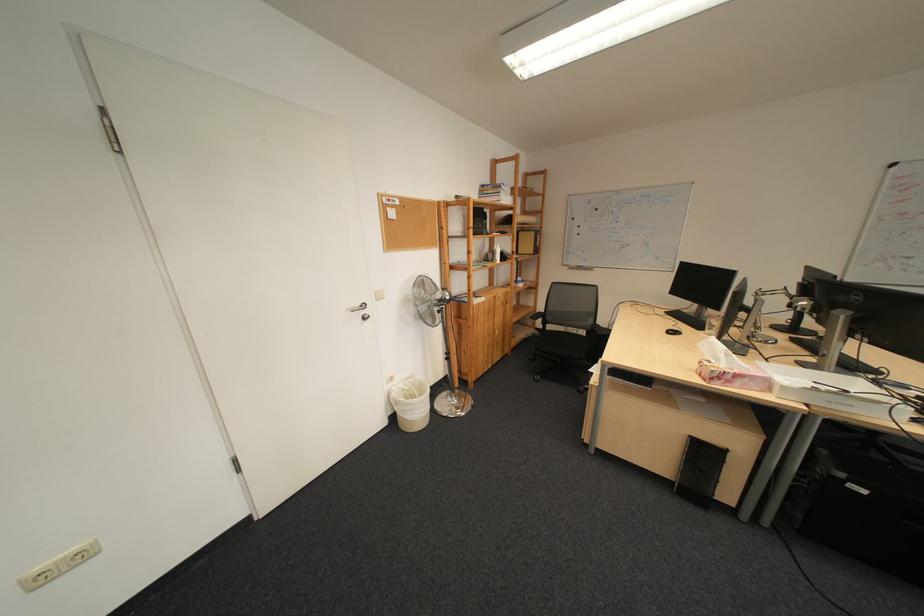
At what (x,y) coordinates should I click in order to perform the action: click on cabinet door handle. Please return your answer as a coordinate pair (x, y). The image size is (924, 616). Looking at the image, I should click on (236, 464).